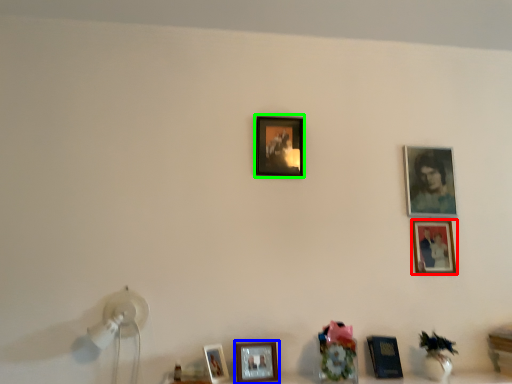
Question: Based on their relative distances, which object is farther from picture frame (highlighted by a red box)? Choose from picture frame (highlighted by a blue box) and picture frame (highlighted by a green box).

Choices:
 (A) picture frame
 (B) picture frame

Answer: (A)